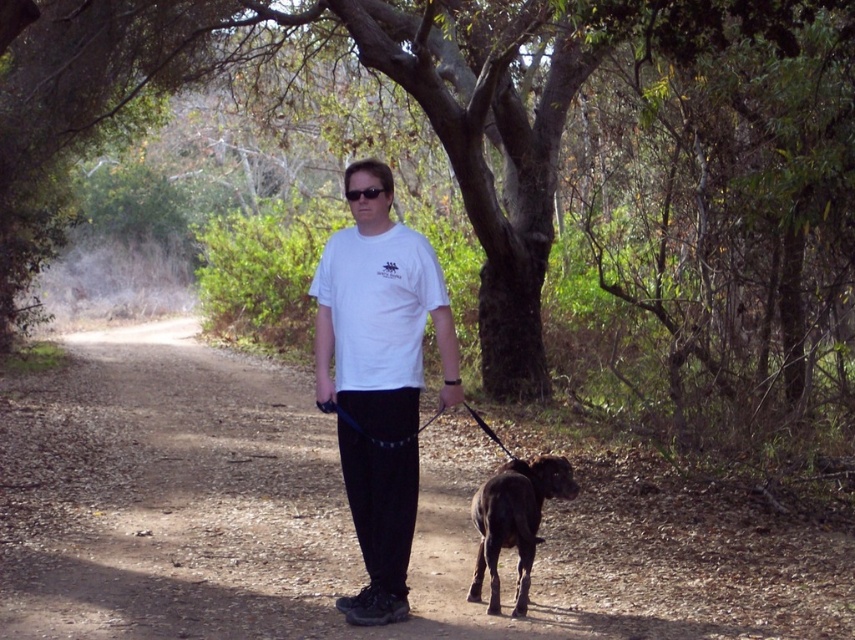
Question: Considering the relative positions of green textured tree at center and black glossy dog at center in the image provided, where is green textured tree at center located with respect to black glossy dog at center?

Choices:
 (A) left
 (B) right

Answer: (A)

Question: Which point appears closest to the camera in this image?

Choices:
 (A) tap(789, 97)
 (B) tap(514, 529)
 (C) tap(376, 576)

Answer: (C)

Question: Can you confirm if green textured tree at center is positioned to the right of white matte t-shirt at center?

Choices:
 (A) yes
 (B) no

Answer: (B)

Question: Which object is farther from the camera taking this photo?

Choices:
 (A) black glossy dog at center
 (B) green textured tree at center

Answer: (B)

Question: Based on their relative distances, which object is farther from the white matte t-shirt at center?

Choices:
 (A) green textured tree at center
 (B) black glossy dog at center

Answer: (A)

Question: Is green textured tree at center to the right of black glossy dog at center from the viewer's perspective?

Choices:
 (A) no
 (B) yes

Answer: (A)